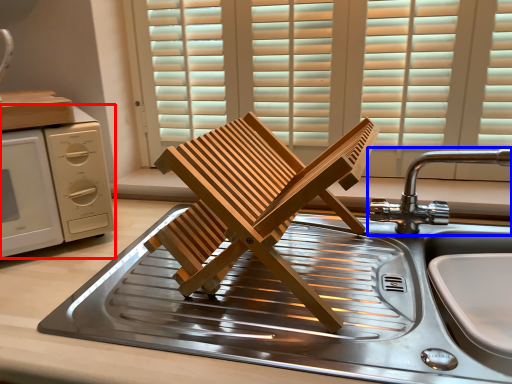
Question: Among these objects, which one is nearest to the camera, home appliance (highlighted by a red box) or tap (highlighted by a blue box)?

Choices:
 (A) home appliance
 (B) tap

Answer: (B)